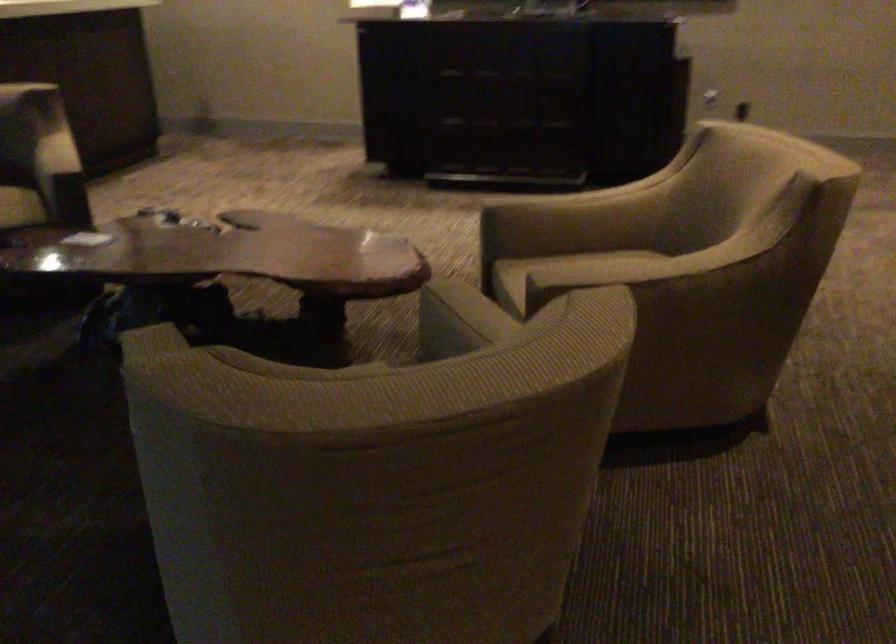
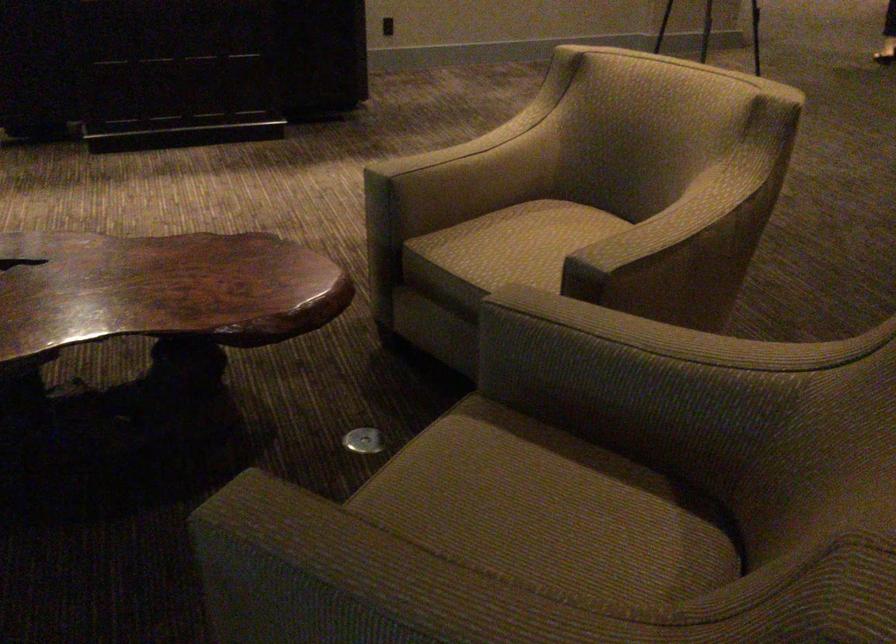
The point at (476,317) is marked in the first image. Where is the corresponding point in the second image?

(631, 330)